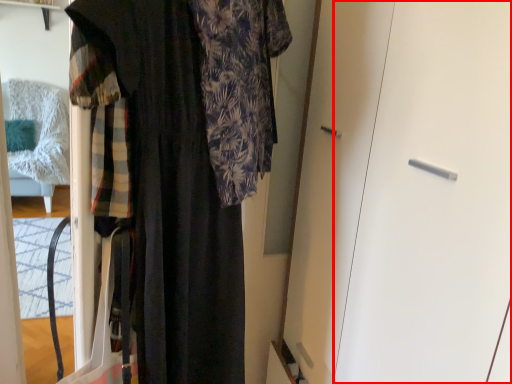
Question: From the image, what is the correct spatial relationship of screen door (annotated by the red box) in relation to fancy dress?

Choices:
 (A) left
 (B) right

Answer: (B)